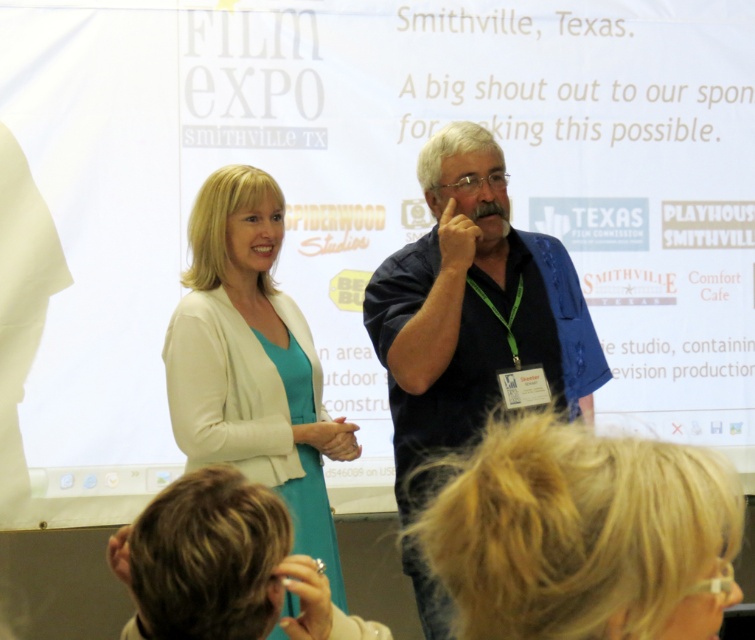
What is located at the coordinates point (473, 314)?

The point (473, 314) indicates the blue cotton shirt at center.

You are attending the Film Expo in Smithville, Texas, and notice two items on the stage. The first is a blue cotton shirt at center, and the second is a matte white blazer at center. Which item is taller?

The blue cotton shirt at center is taller than the matte white blazer at center.